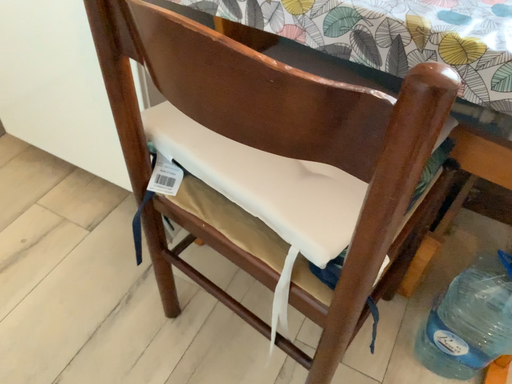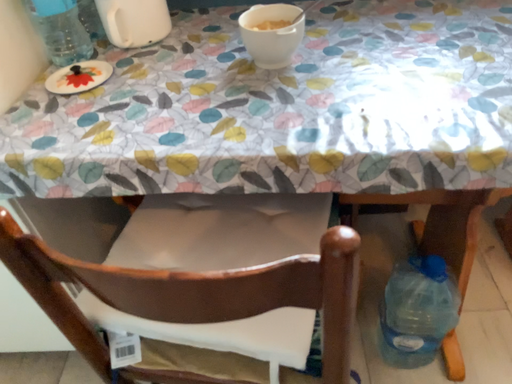
Question: How did the camera likely rotate when shooting the video?

Choices:
 (A) rotated downward
 (B) rotated upward

Answer: (B)